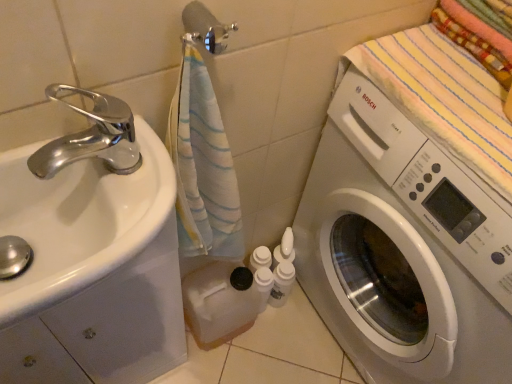
Where is `vacant point above striped cotton beach towel at upper right (from a real-world perspective)`? Image resolution: width=512 pixels, height=384 pixels. vacant point above striped cotton beach towel at upper right (from a real-world perspective) is located at coordinates (463, 80).